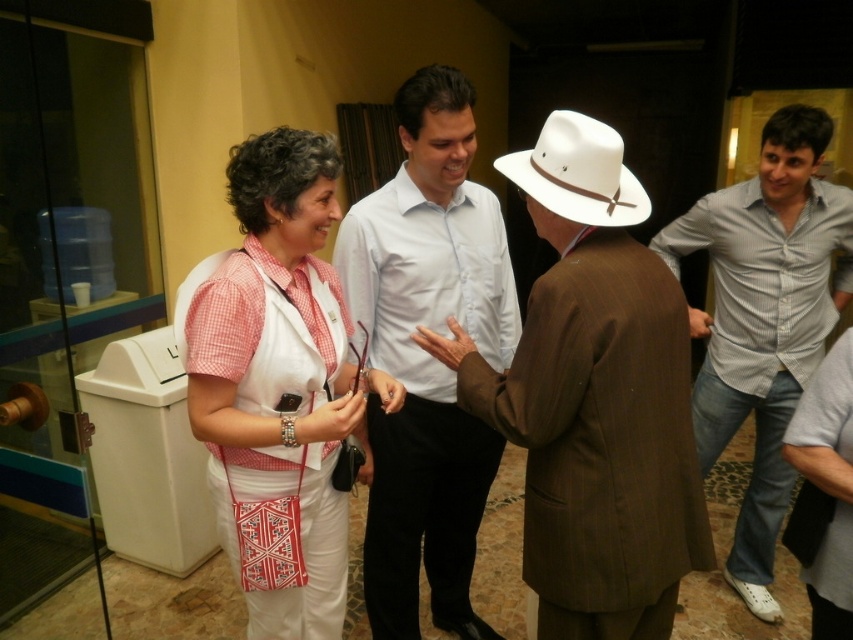
Question: Where is brown pinstripe suit at center located in relation to light blue striped shirt at right in the image?

Choices:
 (A) below
 (B) above

Answer: (A)

Question: Can you confirm if light blue shirt at center is positioned to the right of gray cotton shirt at right?

Choices:
 (A) yes
 (B) no

Answer: (B)

Question: Which object is farther from the camera taking this photo?

Choices:
 (A) white felt cowboy hat at center
 (B) light blue striped shirt at right
 (C) gray cotton shirt at right
 (D) white woven vest at center

Answer: (B)

Question: Which of the following is the farthest from the observer?

Choices:
 (A) gray cotton shirt at right
 (B) white woven vest at center
 (C) light blue striped shirt at right
 (D) brown pinstripe suit at center

Answer: (C)

Question: Which point appears farthest from the camera in this image?

Choices:
 (A) (379, 211)
 (B) (776, 472)
 (C) (680, 509)

Answer: (B)

Question: Can you confirm if light blue shirt at center is thinner than white felt cowboy hat at center?

Choices:
 (A) yes
 (B) no

Answer: (B)